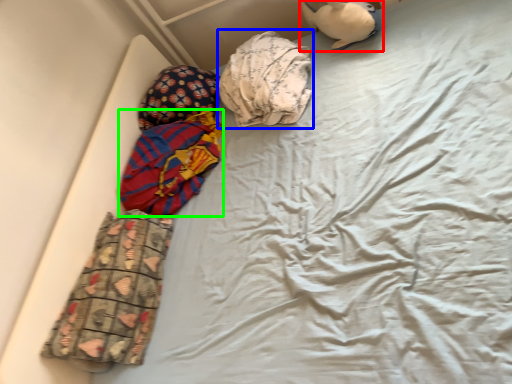
Question: Which object is positioned farthest from toy (highlighted by a red box)? Select from material (highlighted by a blue box) and material (highlighted by a green box).

Choices:
 (A) material
 (B) material

Answer: (B)